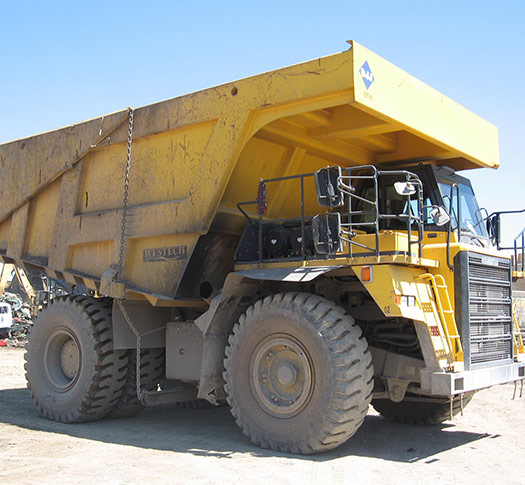
Find the location of a particular element. mirror is located at coordinates (401, 188).